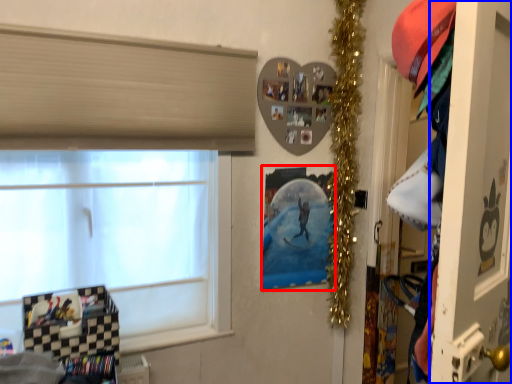
Question: Which object is closer to the camera taking this photo, picture frame (highlighted by a red box) or screen door (highlighted by a blue box)?

Choices:
 (A) picture frame
 (B) screen door

Answer: (B)